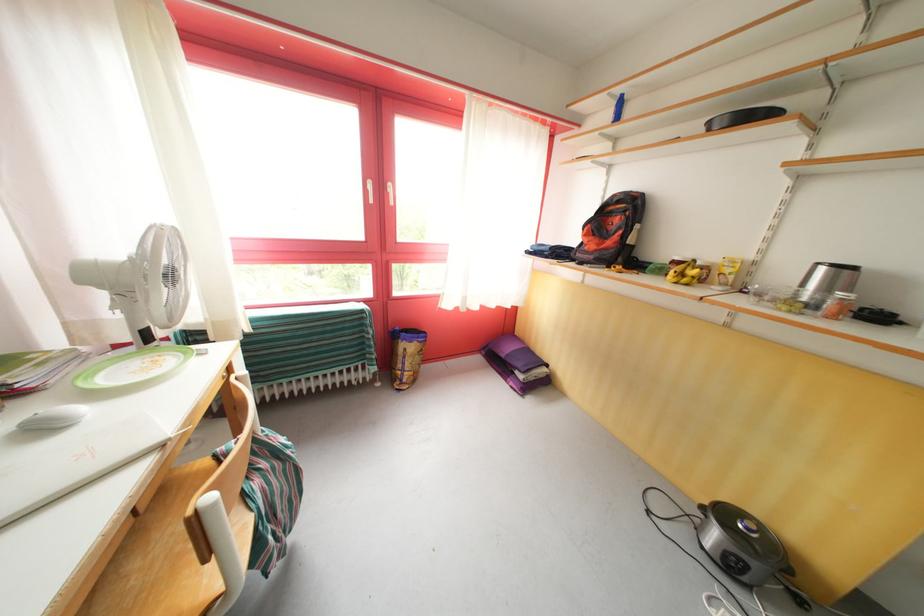
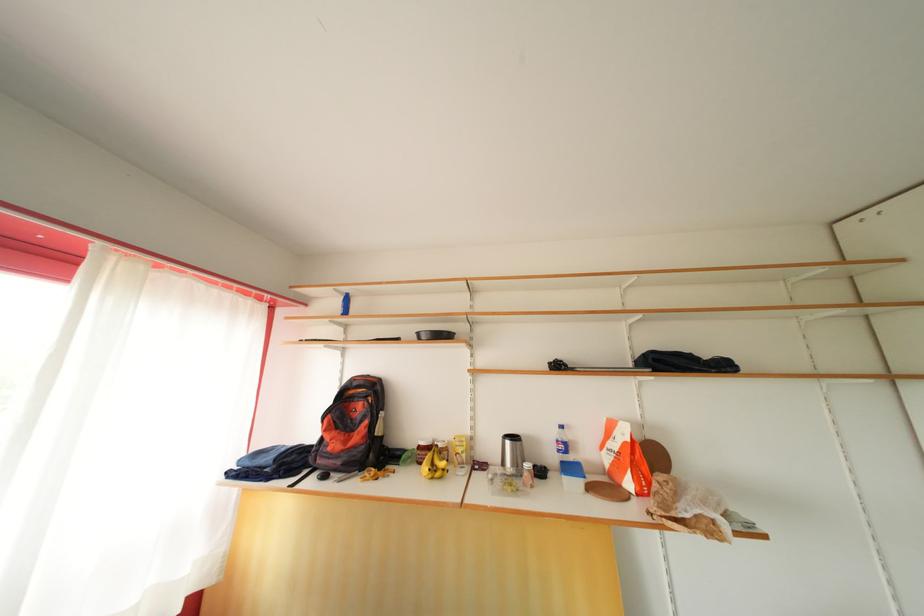
Locate, in the second image, the point that corresponds to (x=688, y=272) in the first image.

(436, 461)